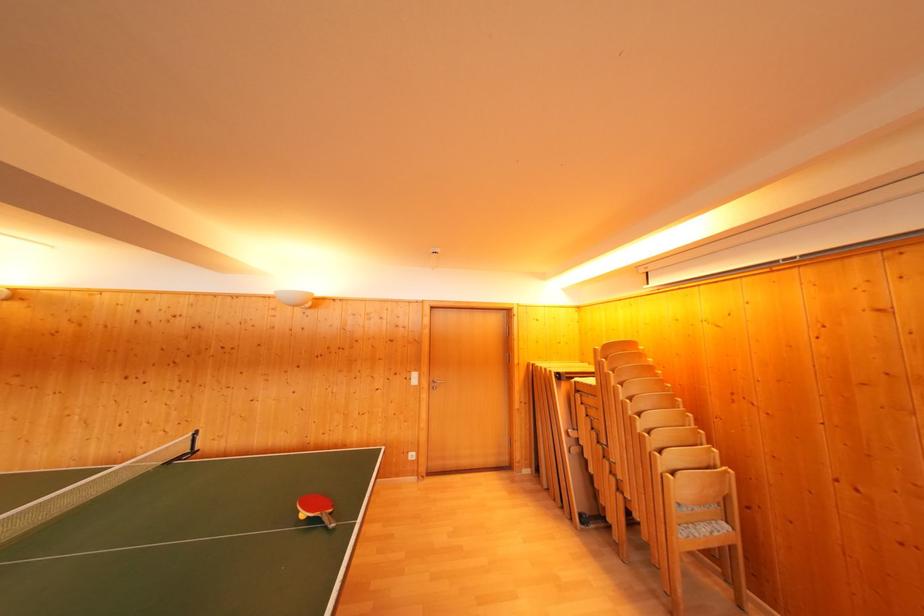
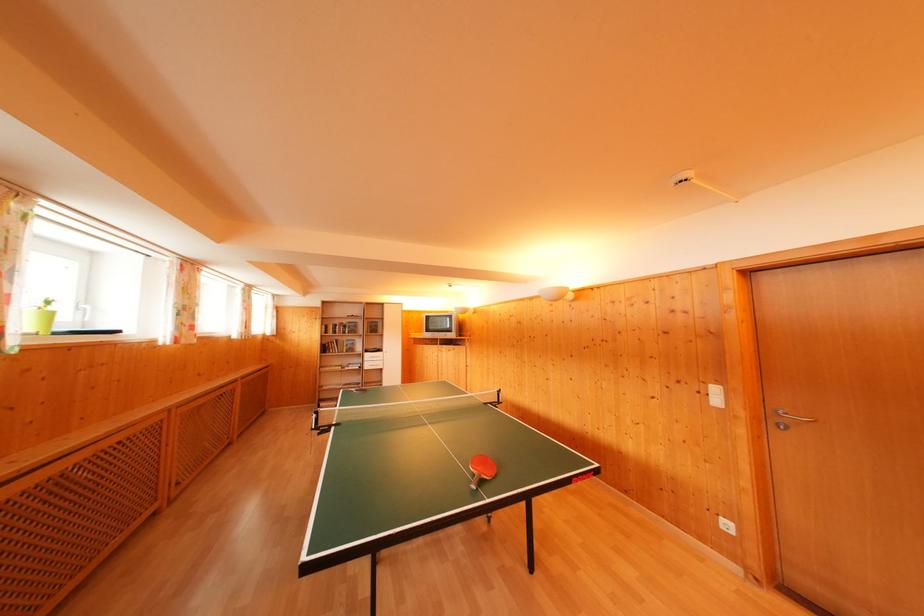
Locate, in the second image, the point that corresponds to point 419,379 in the first image.

(721, 395)